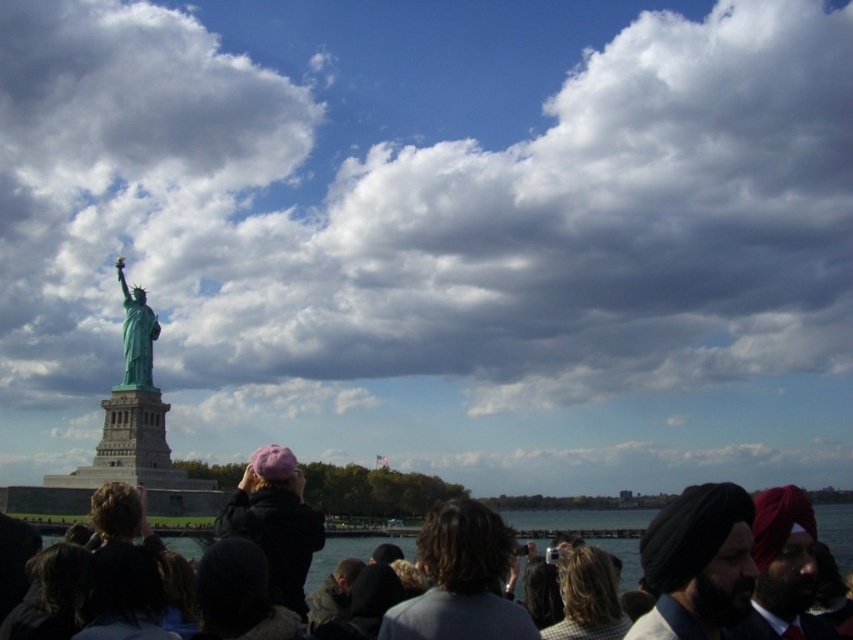
Does black turban at lower right have a greater height compared to pink fabric hat at upper center?

Correct, black turban at lower right is much taller as pink fabric hat at upper center.

Between black turban at lower right and pink fabric hat at upper center, which one has less height?

Standing shorter between the two is pink fabric hat at upper center.

The width and height of the screenshot is (853, 640). Find the location of `black turban at lower right`. black turban at lower right is located at coordinates (698, 563).

Which is behind, point (440, 228) or point (563, 518)?

The point (440, 228) is more distant.

Can you confirm if cloudy sky at upper center is smaller than pink fabric hat at upper center?

No.

This screenshot has width=853, height=640. Find the location of `cloudy sky at upper center`. cloudy sky at upper center is located at coordinates [428, 214].

Locate an element on the screen. The image size is (853, 640). cloudy sky at upper center is located at coordinates (428, 214).

Who is positioned more to the right, purple woolen hat at center or pink fabric hat at upper center?

From the viewer's perspective, pink fabric hat at upper center appears more on the right side.

Is purple woolen hat at center shorter than pink fabric hat at upper center?

Incorrect, purple woolen hat at center's height does not fall short of pink fabric hat at upper center's.

The image size is (853, 640). I want to click on purple woolen hat at center, so click(276, 522).